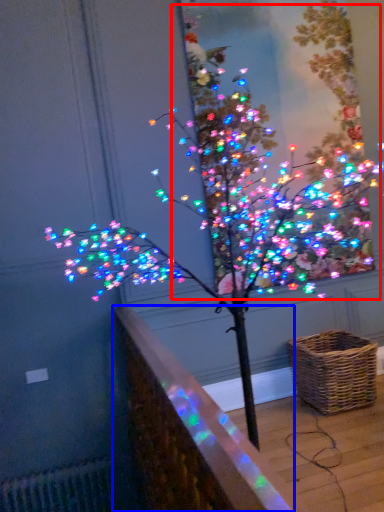
Question: Which of the following is the farthest to the observer, christmas tree (highlighted by a red box) or ledge (highlighted by a blue box)?

Choices:
 (A) christmas tree
 (B) ledge

Answer: (A)